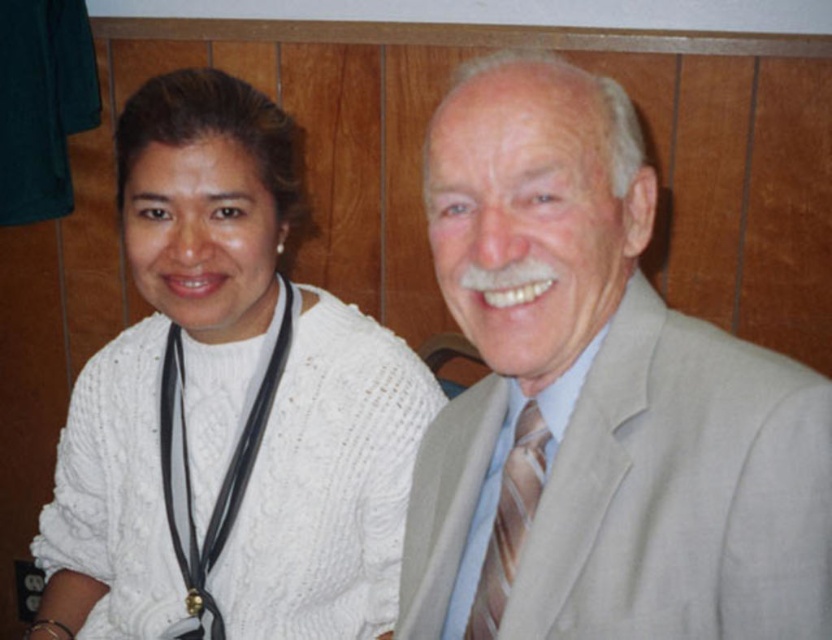
Question: Which object is the farthest from the brown striped tie at center?

Choices:
 (A) black leather stethoscope at left
 (B) light beige suit at center

Answer: (A)

Question: Which object is the farthest from the brown striped tie at center?

Choices:
 (A) black leather stethoscope at left
 (B) light beige suit at center

Answer: (A)

Question: Observing the image, what is the correct spatial positioning of light beige suit at center in reference to brown striped tie at center?

Choices:
 (A) below
 (B) above

Answer: (B)

Question: Does light beige suit at center appear over brown striped tie at center?

Choices:
 (A) no
 (B) yes

Answer: (B)

Question: Which of the following is the farthest from the observer?

Choices:
 (A) white knitted sweater at left
 (B) black leather stethoscope at left

Answer: (B)

Question: Does white knitted sweater at left have a larger size compared to brown striped tie at center?

Choices:
 (A) yes
 (B) no

Answer: (A)